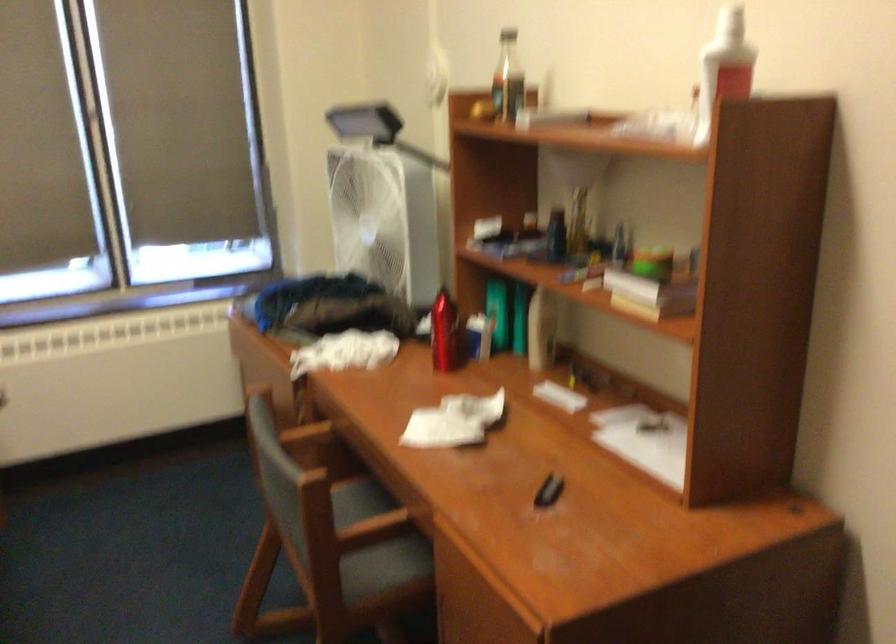
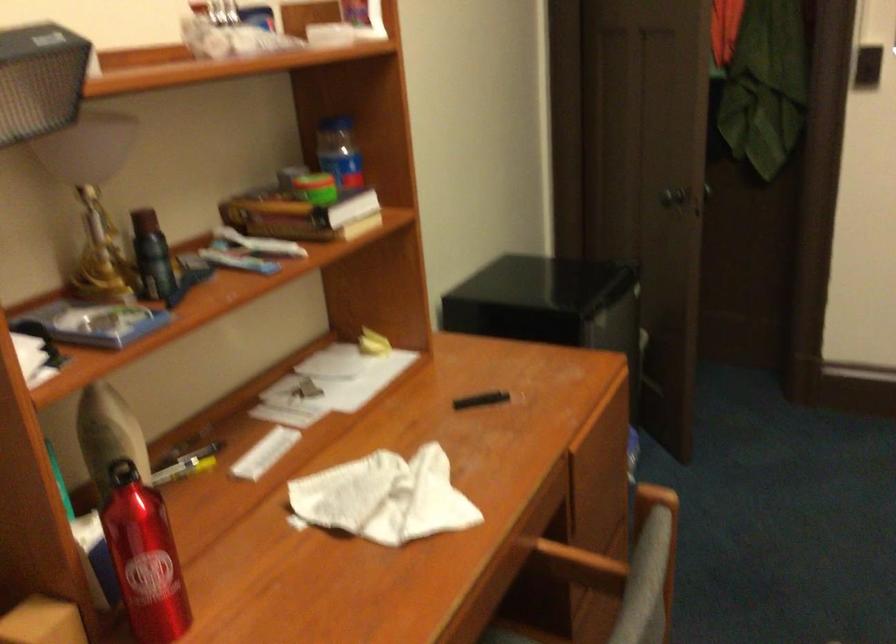
In the second image, find the point that corresponds to [374,527] in the first image.

(579, 565)